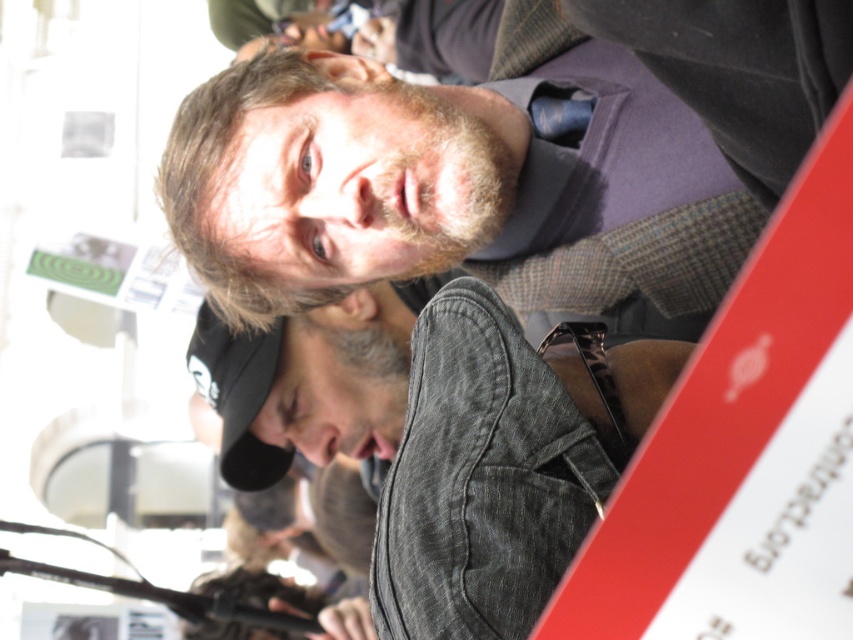
You are standing in the crowd at this event and want to move from the point closer to the front to the point further back. Which path should you take between the two points, point (552, 125) and point (280, 381)?

To move from the closer point to the further one, you should go from point (552, 125) to point (280, 381) since point (552, 125) is closer to the viewer and point (280, 381) is further back.

Based on the scene description, where is the matte gray jacket at center located in terms of coordinates?

The matte gray jacket at center is located at coordinates point (450, 186).